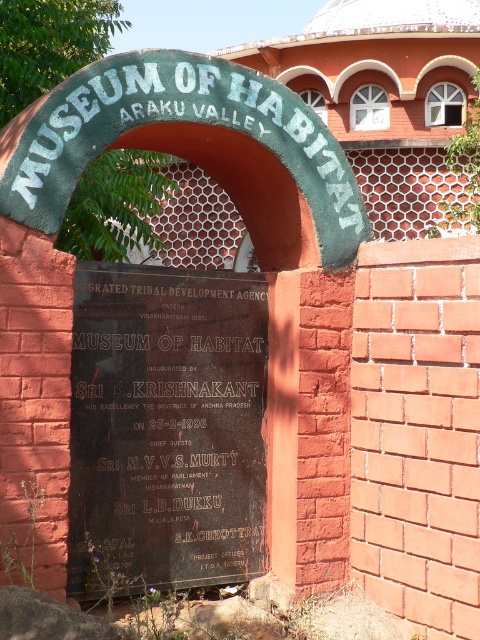
Does green painted metal signboard at center have a larger size compared to black polished stone plaque at center?

Correct, green painted metal signboard at center is larger in size than black polished stone plaque at center.

Is point (59, 566) closer to viewer compared to point (242, 355)?

Yes, point (59, 566) is closer to viewer.

Between point (85, 131) and point (184, 541), which one is positioned in front?

Point (85, 131)

The width and height of the screenshot is (480, 640). In order to click on green painted metal signboard at center in this screenshot , I will do `click(257, 260)`.